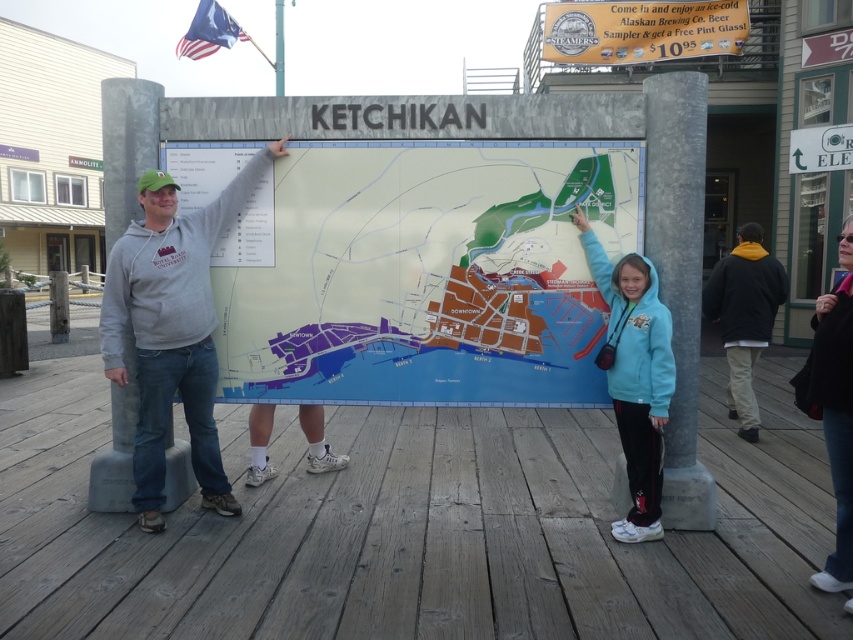
Question: Which point is closer to the camera?

Choices:
 (A) (730, 314)
 (B) (570, 45)

Answer: (A)

Question: Which object is positioned closest to the metallic gold sign at upper center?

Choices:
 (A) american flag at upper left
 (B) gray hoodie at center

Answer: (A)

Question: Which of the following is the closest to the observer?

Choices:
 (A) (838, 408)
 (B) (672, 376)

Answer: (A)

Question: Can you confirm if tweety blue hoodie at upper right is wider than white plastic sign at upper right?

Choices:
 (A) yes
 (B) no

Answer: (B)

Question: Is gray hoodie at center smaller than white plastic sign at upper right?

Choices:
 (A) yes
 (B) no

Answer: (B)

Question: Does metallic gold sign at upper center lie behind denim jacket at lower right?

Choices:
 (A) no
 (B) yes

Answer: (B)